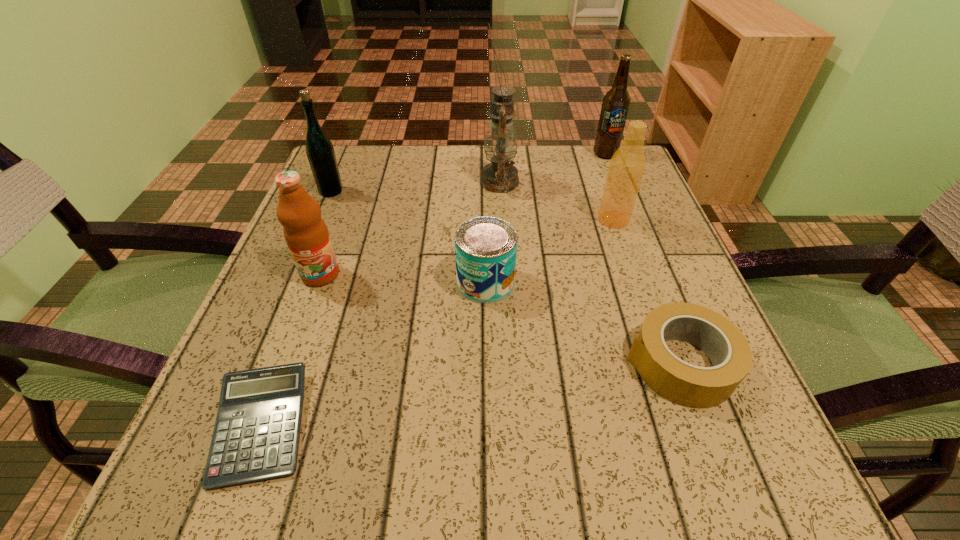
Where is `object that stands as the third closest to the nearest beer bottle`? The height and width of the screenshot is (540, 960). object that stands as the third closest to the nearest beer bottle is located at coordinates (485, 247).

Where is `the fourth closest object to the second shortest object`? The height and width of the screenshot is (540, 960). the fourth closest object to the second shortest object is located at coordinates (256, 435).

Locate an element on the screen. The height and width of the screenshot is (540, 960). beer bottle object that ranks as the second closest to the fruit juice is located at coordinates (627, 166).

Identify the location of beer bottle that can be found as the third closest to the fruit juice. (616, 102).

Where is `free space that satisfies the following two spatial constraints: 1. on the label of the farthest object; 2. at the edge of the seventh tallest object`? The width and height of the screenshot is (960, 540). free space that satisfies the following two spatial constraints: 1. on the label of the farthest object; 2. at the edge of the seventh tallest object is located at coordinates (688, 363).